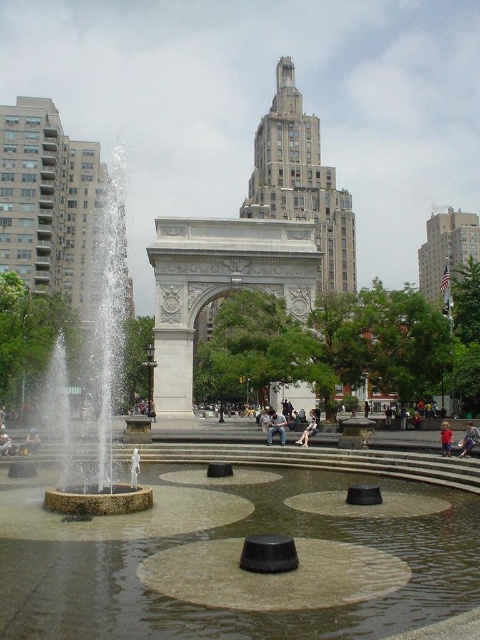
Question: Which point appears closest to the camera in this image?

Choices:
 (A) (310, 429)
 (B) (31, 428)
 (C) (285, 428)

Answer: (C)

Question: Can you confirm if blue denim jeans at lower right is wider than light brown leather jacket at center?

Choices:
 (A) no
 (B) yes

Answer: (B)

Question: Is white marble fountain at left bigger than light blue denim jeans at lower left?

Choices:
 (A) no
 (B) yes

Answer: (B)

Question: Which of the following is the closest to the observer?

Choices:
 (A) light brown hair at lower right
 (B) denim jacket at center
 (C) light blue denim jeans at lower left

Answer: (A)

Question: Is denim jacket at center positioned in front of light brown leather jacket at center?

Choices:
 (A) yes
 (B) no

Answer: (B)

Question: Which point is closer to the camera?

Choices:
 (A) denim jacket at center
 (B) blue denim jeans at lower right
 (C) light blue denim jeans at lower left
 (D) light brown leather jacket at center

Answer: (B)